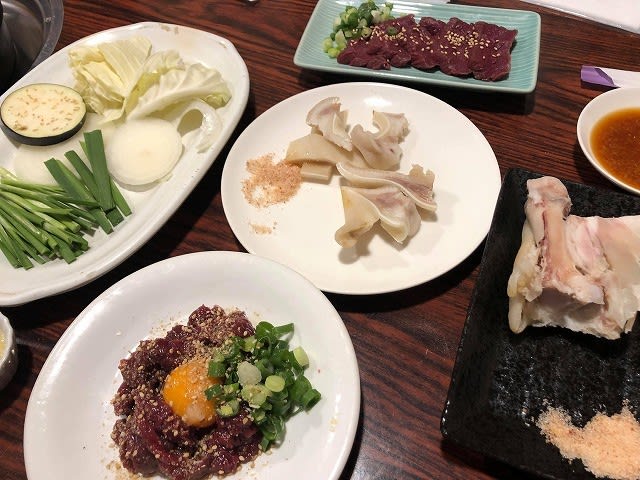
Identify the location of bowl. The image size is (640, 480). (598, 100).